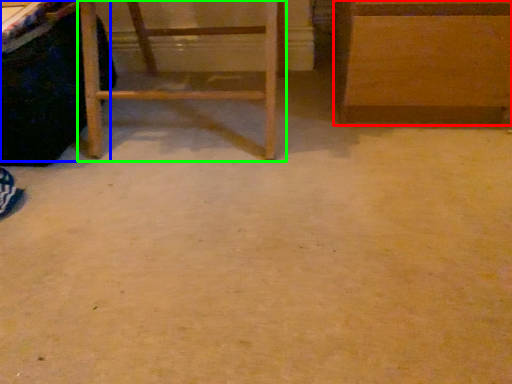
Question: Which object is the farthest from furniture (highlighted by a red box)? Choose among these: vanity (highlighted by a blue box) or furniture (highlighted by a green box).

Choices:
 (A) vanity
 (B) furniture

Answer: (A)